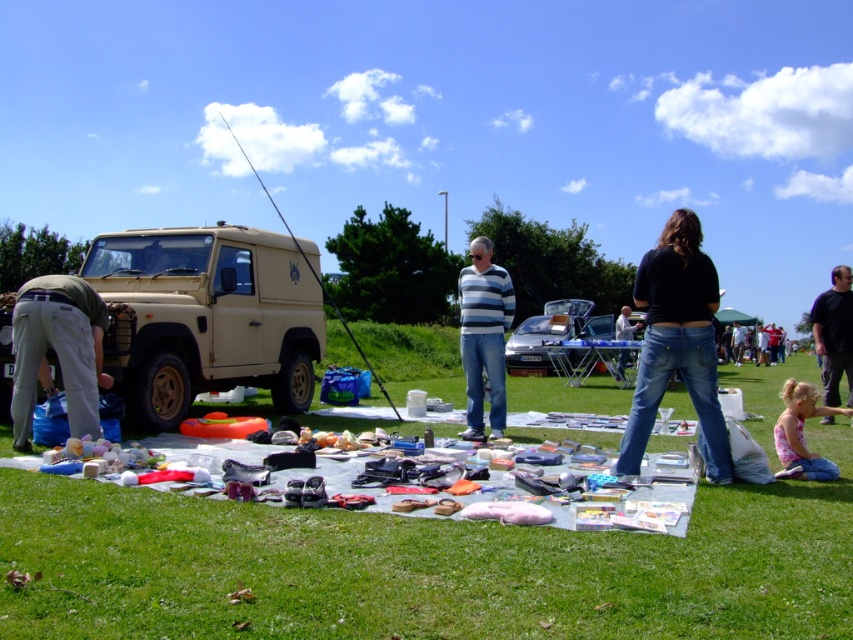
How much distance is there between black fabric shirt at right and denim jeans at center?

black fabric shirt at right is 7.68 meters away from denim jeans at center.

Is black fabric shirt at right positioned behind denim jeans at center?

No, it is in front of denim jeans at center.

Does point (822, 372) come in front of point (625, 352)?

Yes, it is in front of point (625, 352).

Identify the location of black fabric shirt at right. Image resolution: width=853 pixels, height=640 pixels. (834, 333).

Is metallic silver picnic table at center below beige matte fishing pole at center?

Correct, metallic silver picnic table at center is located below beige matte fishing pole at center.

Identify the location of metallic silver picnic table at center. pos(593,358).

What are the coordinates of `metallic silver picnic table at center` in the screenshot? It's located at (593, 358).

Who is more distant from viewer, (831, 406) or (560, 365)?

Positioned behind is point (560, 365).

Does pink floral shirt at lower right lie behind metallic silver picnic table at center?

No, pink floral shirt at lower right is closer to the viewer.

Between point (793, 438) and point (636, 340), which one is positioned behind?

Positioned behind is point (636, 340).

Find the location of a particular element. The height and width of the screenshot is (640, 853). pink floral shirt at lower right is located at coordinates (801, 433).